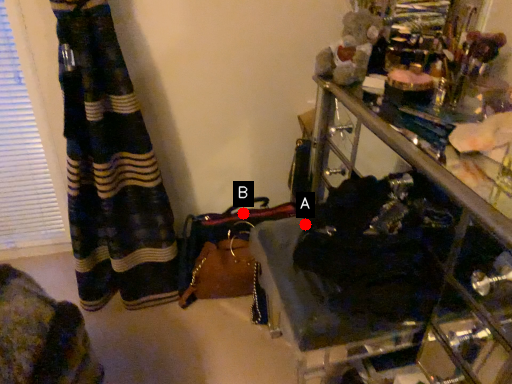
Question: Two points are circled on the image, labeled by A and B beside each circle. Which point is closer to the camera?

Choices:
 (A) A is closer
 (B) B is closer

Answer: (A)